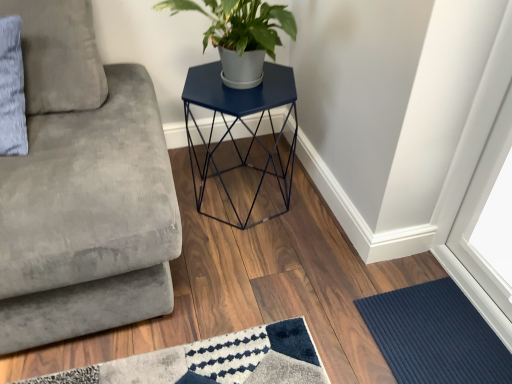
Question: Is navy blue ribbed mat at lower right completely or partially inside gray fabric pillow at upper left?

Choices:
 (A) no
 (B) yes

Answer: (A)

Question: Is gray fabric pillow at upper left positioned far away from navy blue ribbed mat at lower right?

Choices:
 (A) no
 (B) yes

Answer: (B)

Question: Is gray fabric pillow at upper left further to the viewer compared to navy blue ribbed mat at lower right?

Choices:
 (A) yes
 (B) no

Answer: (B)

Question: Is gray fabric pillow at upper left facing away from navy blue ribbed mat at lower right?

Choices:
 (A) no
 (B) yes

Answer: (A)

Question: From the image's perspective, does gray fabric pillow at upper left appear lower than navy blue ribbed mat at lower right?

Choices:
 (A) yes
 (B) no

Answer: (B)

Question: Does gray fabric pillow at upper left have a lesser width compared to navy blue ribbed mat at lower right?

Choices:
 (A) no
 (B) yes

Answer: (B)

Question: Is navy blue ribbed mat at lower right further to camera compared to gray fabric pillow at upper left?

Choices:
 (A) yes
 (B) no

Answer: (A)

Question: Is navy blue ribbed mat at lower right wider than gray fabric pillow at upper left?

Choices:
 (A) yes
 (B) no

Answer: (A)

Question: From a real-world perspective, is navy blue ribbed mat at lower right positioned under gray fabric pillow at upper left based on gravity?

Choices:
 (A) no
 (B) yes

Answer: (B)

Question: Is navy blue ribbed mat at lower right oriented towards gray fabric pillow at upper left?

Choices:
 (A) yes
 (B) no

Answer: (B)

Question: Is navy blue ribbed mat at lower right completely or partially outside of gray fabric pillow at upper left?

Choices:
 (A) yes
 (B) no

Answer: (A)

Question: Does navy blue ribbed mat at lower right touch gray fabric pillow at upper left?

Choices:
 (A) no
 (B) yes

Answer: (A)

Question: Considering the relative sizes of navy blue ribbed mat at lower right and matte blue hexagonal table at center in the image provided, is navy blue ribbed mat at lower right bigger than matte blue hexagonal table at center?

Choices:
 (A) no
 (B) yes

Answer: (A)